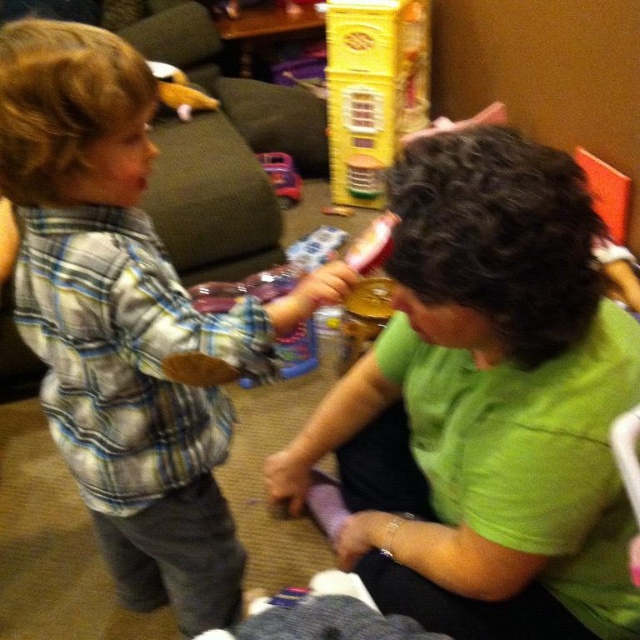
You are a photographer standing at the camera position. You want to take a closeup shot of the plaid cotton shirt at left. Is it within your camera range if your camera can focus as close as 30 inches?

The plaid cotton shirt at left is 29.55 inches away from camera, so yes, it is within the camera range since it is closer than the minimum focus distance of 30 inches.

You are organizing a play area and need to know which item takes up more horizontal space. Which is wider between the plaid cotton shirt at left and the yellow plastic dollhouse at upper center?

The plaid cotton shirt at left is wider than the yellow plastic dollhouse at upper center according to the description.

You are a photographer standing in front of the green matte shirt at center. You want to take a clear photo of it without any blur. The camera requires a minimum distance of 24 inches to focus properly. Can you take the photo from your current position?

The distance between the green matte shirt at center and the camera is 25.70 inches, which is greater than the required 24 inches. Therefore, you can take a clear photo without blur from your current position.